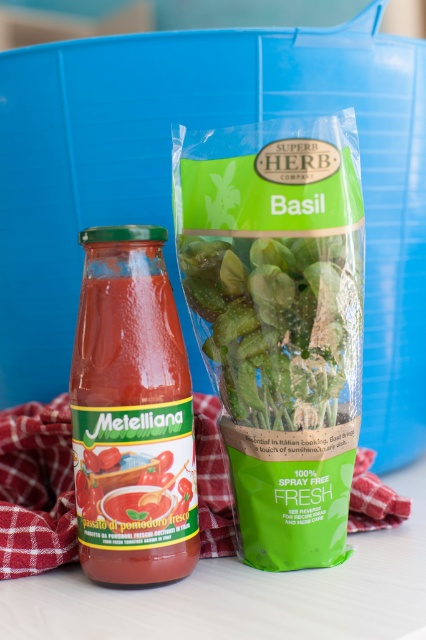
You are an AI assistant analyzing the composition of the image. The translucent glass jar of tomato sauce at center is represented by point (132, 413). Can you confirm the coordinates of this point relative to the other objects in the scene?

The translucent glass jar of tomato sauce at center is represented by point (132, 413), which is the central point in the image.

Based on the photo, you are preparing a dish that requires both tomato sauce and fresh basil. You have a 10 cm wide plate where you need to place the translucent glass jar of tomato sauce at center and the green leafy basil at center. Considering their widths, will they both fit side by side on the plate without overlapping?

The translucent glass jar of tomato sauce at center has a lesser width compared to green leafy basil at center. However, since both are placed at the center, they will overlap each other, making it impossible to fit them side by side without overlapping on the 10 cm wide plate.